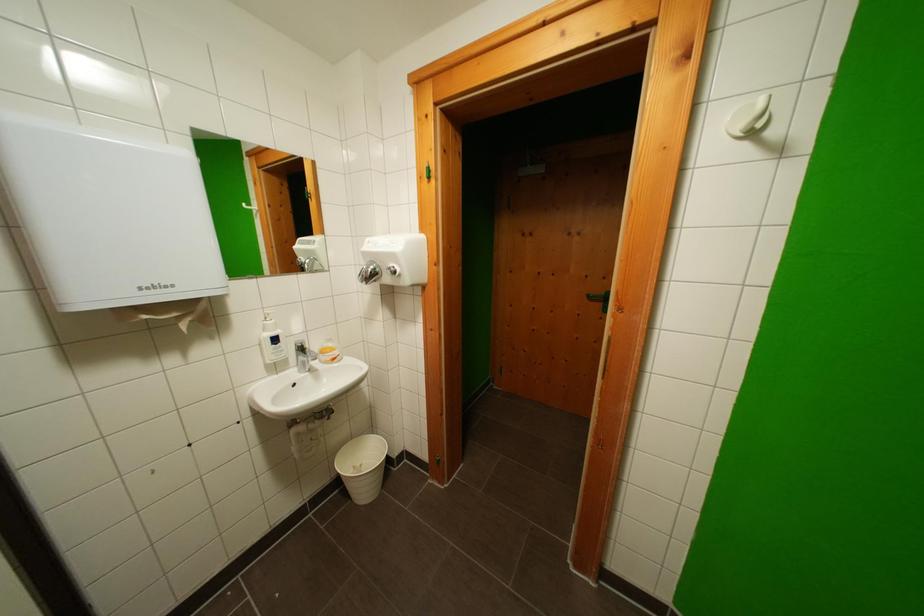
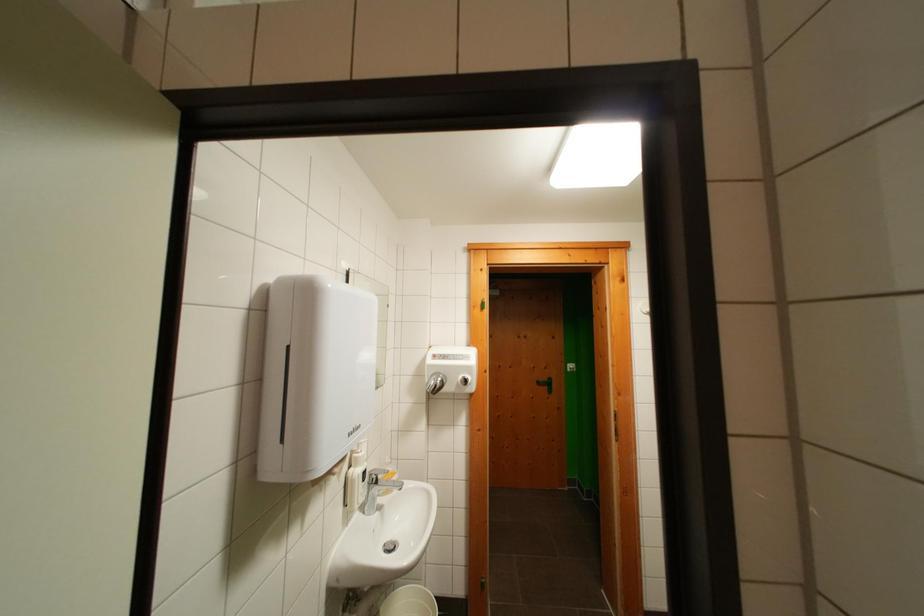
Find the pixel in the second image that matches (596,301) in the first image.

(544, 387)